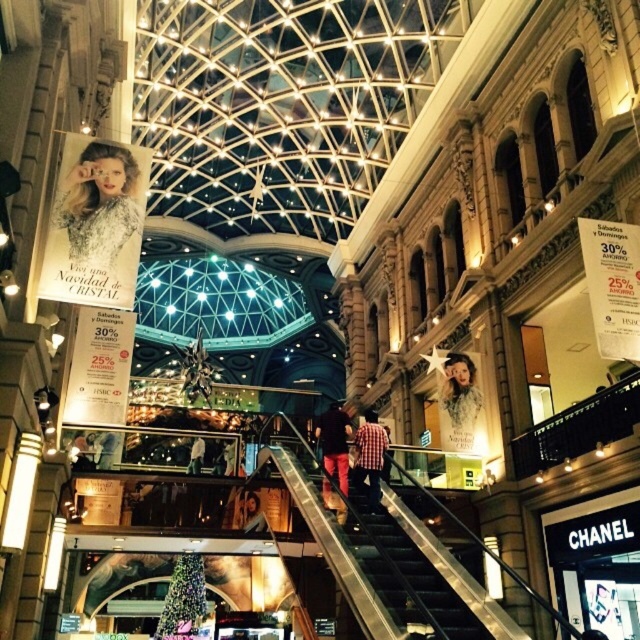
You are a customer standing in the mall and want to take a photo of both the matte silver poster at upper left and the multicolored glass christmas tree at lower left. Which object should you position yourself below to capture both in the frame?

You should position yourself below the matte silver poster at upper left because it is located above the multicolored glass christmas tree at lower left, so standing below the poster will allow you to see both objects in your photo.

You are a store manager checking the layout of your mall. You have a new mannequin wearing a matte white blouse at center that you want to place next to the multicolored glass christmas tree at lower left. Considering their widths, will the mannequin fit next to the tree without overlapping?

The multicolored glass christmas tree at lower left is wider than the matte white blouse at center. Since the tree is wider, there should be enough space to place the mannequin next to it without overlapping, provided the available area accommodates both widths.